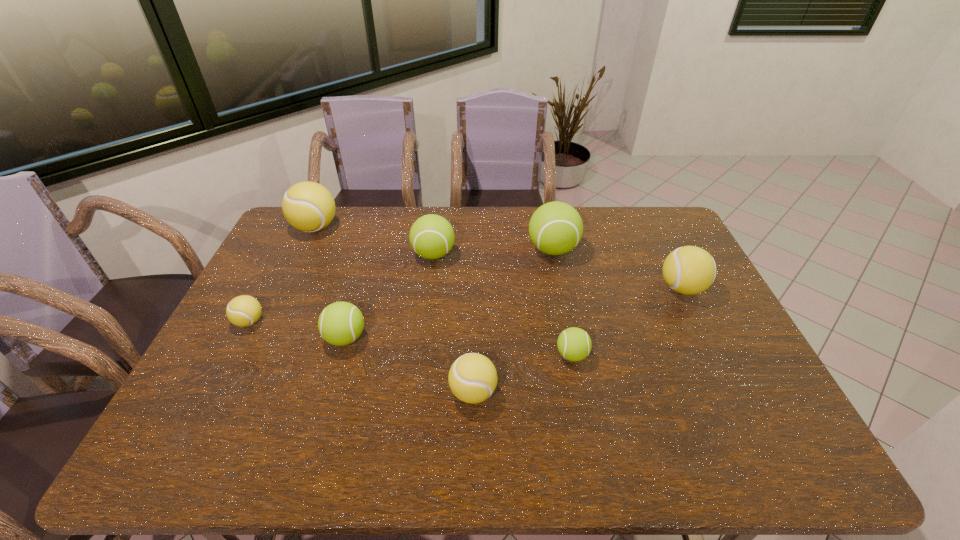
In order to click on free space that is in between the third object from left to right and the biggest green tennis ball in this screenshot , I will do `click(449, 294)`.

The height and width of the screenshot is (540, 960). I want to click on free space between the third farthest yellow tennis ball and the smallest green tennis ball, so click(x=411, y=339).

Locate an element on the screen. The height and width of the screenshot is (540, 960). vacant area that lies between the nearest yellow tennis ball and the farthest yellow tennis ball is located at coordinates pos(395,310).

Identify the location of vacant space that is in between the fifth object from right to left and the nearest tennis ball. The image size is (960, 540). point(453,323).

Where is `free point between the second farthest yellow tennis ball and the smallest yellow tennis ball`? This screenshot has width=960, height=540. free point between the second farthest yellow tennis ball and the smallest yellow tennis ball is located at coordinates click(x=466, y=305).

Point out which object is positioned as the sixth nearest to the fourth tennis ball from left to right. Please provide its 2D coordinates. Your answer should be formatted as a tuple, i.e. [(x, y)], where the tuple contains the x and y coordinates of a point satisfying the conditions above.

[(244, 310)]

Point out which object is positioned as the fourth nearest to the sixth tennis ball from right to left. Please provide its 2D coordinates. Your answer should be formatted as a tuple, i.e. [(x, y)], where the tuple contains the x and y coordinates of a point satisfying the conditions above.

[(308, 206)]

The width and height of the screenshot is (960, 540). In order to click on tennis ball that is the fourth closest to the biggest yellow tennis ball in this screenshot , I will do `click(555, 228)`.

The image size is (960, 540). In order to click on tennis ball object that ranks as the fourth closest to the nearest yellow tennis ball in this screenshot , I will do `click(555, 228)`.

Identify which yellow tennis ball is the second nearest to the third nearest yellow tennis ball. Please provide its 2D coordinates. Your answer should be formatted as a tuple, i.e. [(x, y)], where the tuple contains the x and y coordinates of a point satisfying the conditions above.

[(308, 206)]